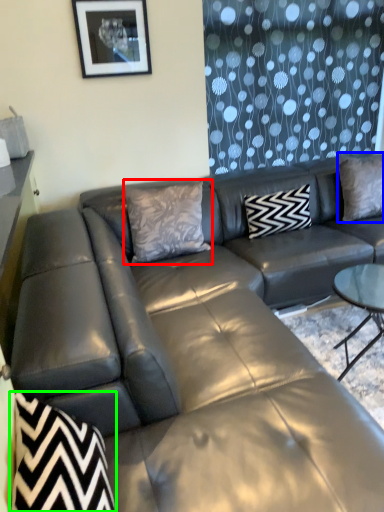
Question: Considering the real-world distances, which object is farthest from pillow (highlighted by a red box)? pillow (highlighted by a blue box) or swivel chair (highlighted by a green box)?

Choices:
 (A) pillow
 (B) swivel chair

Answer: (B)